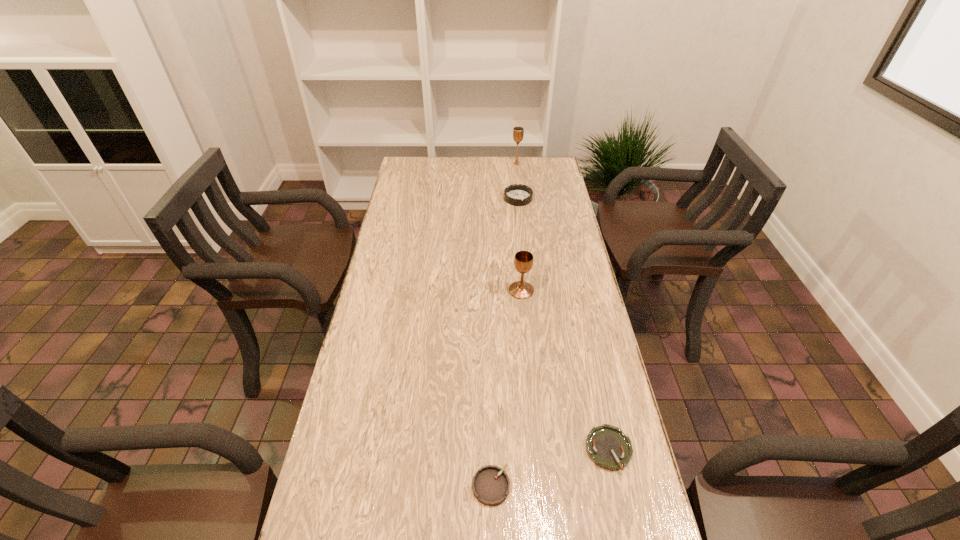
Find the location of `vacant point located between the farthest object and the rightmost ashtray`. vacant point located between the farthest object and the rightmost ashtray is located at coordinates (563, 307).

The width and height of the screenshot is (960, 540). What are the coordinates of `free space between the leftmost object and the fourth nearest object` in the screenshot? It's located at (505, 342).

This screenshot has width=960, height=540. What are the coordinates of `vacant space that is in between the rightmost object and the farthest ashtray` in the screenshot? It's located at (564, 324).

Locate an element on the screen. free point between the nearer chalice and the second farthest object is located at coordinates (519, 245).

Identify the location of blank region between the shorter chalice and the farthest object. (518, 227).

The height and width of the screenshot is (540, 960). In order to click on unoccupied area between the farther chalice and the rightmost ashtray in this screenshot , I will do 563,307.

Where is `vacant space that's between the leftmost ashtray and the tallest object`? vacant space that's between the leftmost ashtray and the tallest object is located at coordinates (504, 325).

The height and width of the screenshot is (540, 960). Identify the location of free space between the farthest ashtray and the third farthest object. (519, 245).

In order to click on free spot between the leftmost object and the shortest object in this screenshot , I will do `click(550, 468)`.

Identify which object is the fourth nearest to the third nearest object. Please provide its 2D coordinates. Your answer should be formatted as a tuple, i.e. [(x, y)], where the tuple contains the x and y coordinates of a point satisfying the conditions above.

[(518, 132)]